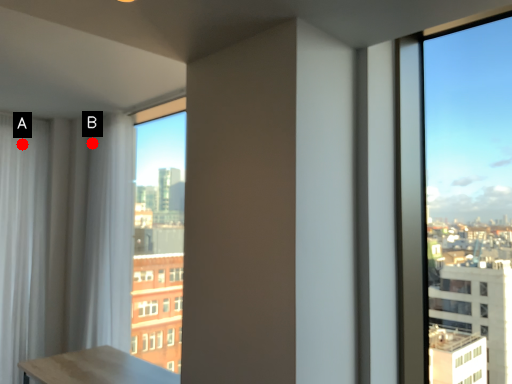
Question: Two points are circled on the image, labeled by A and B beside each circle. Which point appears farthest from the camera in this image?

Choices:
 (A) A is further
 (B) B is further

Answer: (A)